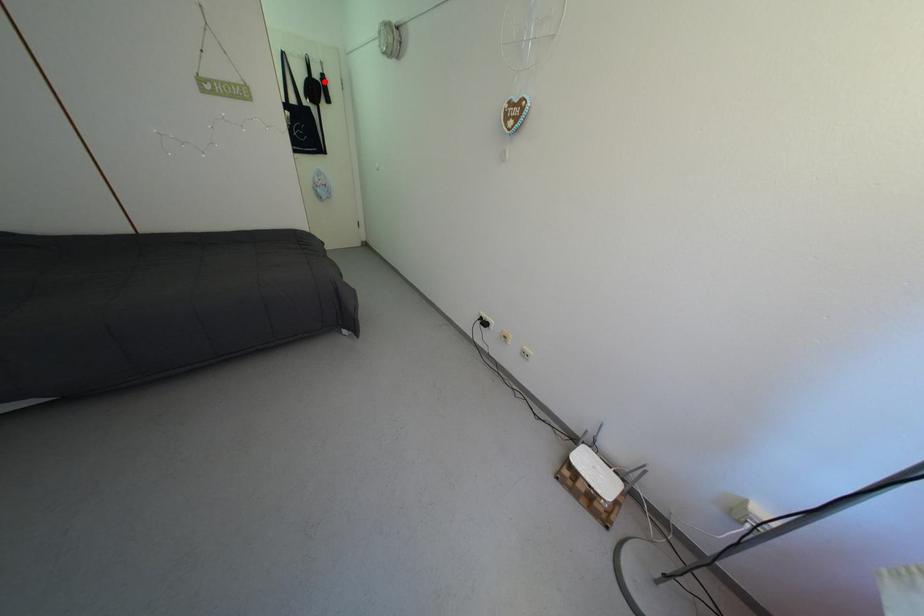
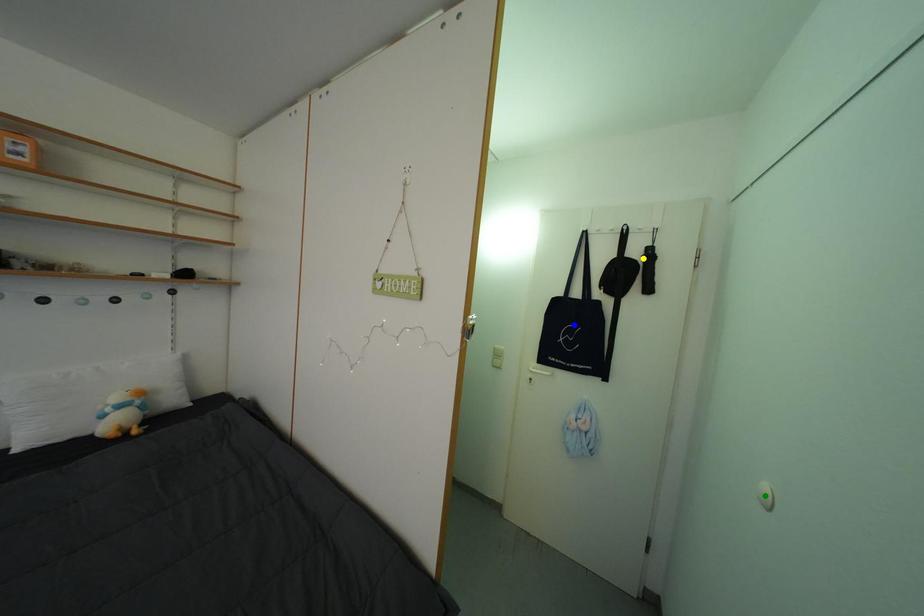
Question: I am providing you with two images of the same scene from different viewpoints. A red point is marked on the first image. You are given multiple points on the second image. Which point in image 2 represents the same 3d spot as the red point in image 1?

Choices:
 (A) green point
 (B) blue point
 (C) yellow point

Answer: (C)